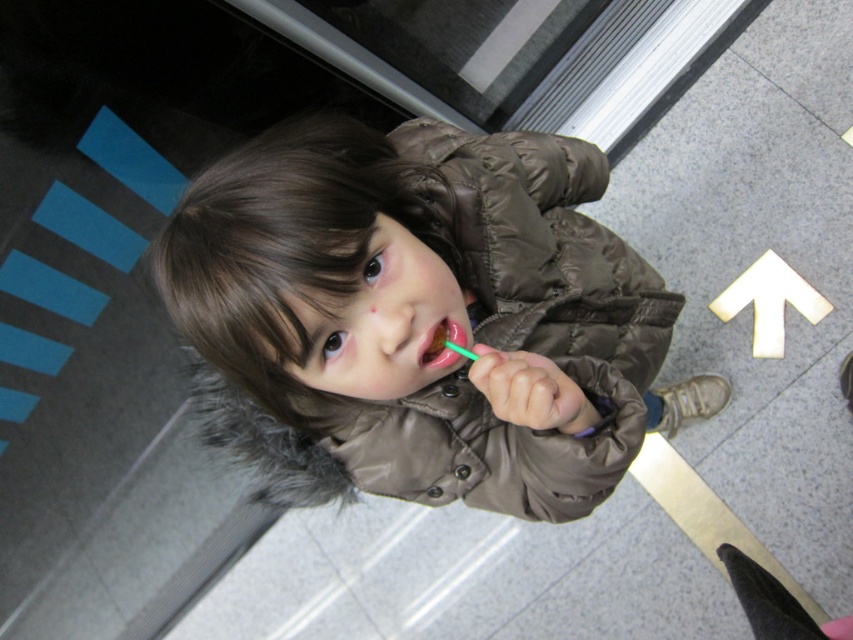
You are a security camera monitoring the entrance. The brown puffy coat at center and the green plastic toothbrush at center are both in your view. Which object is closer to the camera?

The brown puffy coat at center is closer to the camera because it is in front of the green plastic toothbrush at center.